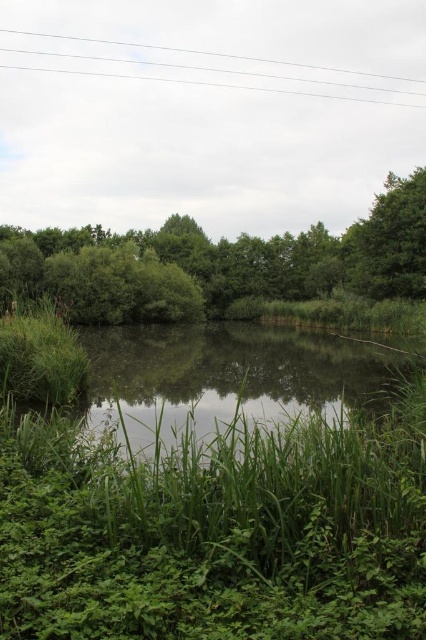
You are an observer looking at the scene. You notice the green leafy tree at center and the white wire at upper center. Which object appears narrower when viewed from your perspective?

The green leafy tree at center appears narrower than the white wire at upper center because it has a lesser width according to the description.